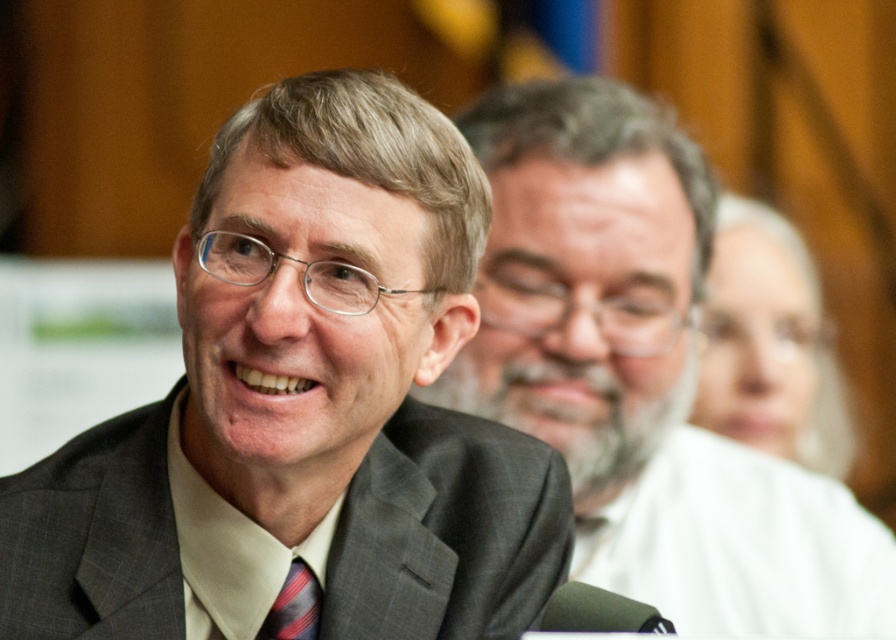
Is gray suit at center smaller than striped fabric tie at center?

Incorrect, gray suit at center is not smaller in size than striped fabric tie at center.

Who is more forward, (632, 472) or (278, 595)?

Point (278, 595)

I want to click on gray suit at center, so click(642, 372).

Is matte gray suit at center behind dark gray textured suit at center?

No, matte gray suit at center is in front of dark gray textured suit at center.

Looking at this image, which is more to the right, matte gray suit at center or dark gray textured suit at center?

Positioned to the right is matte gray suit at center.

Between point (368, 515) and point (527, 506), which one is positioned in front?

Positioned in front is point (368, 515).

What are the coordinates of `matte gray suit at center` in the screenshot? It's located at (303, 406).

Is point (358, 76) positioned behind point (304, 612)?

No.

Is matte gray suit at center further to camera compared to striped fabric tie at center?

No, it is in front of striped fabric tie at center.

Between point (457, 228) and point (289, 598), which one is positioned behind?

Point (289, 598)

This screenshot has height=640, width=896. In order to click on matte gray suit at center in this screenshot , I will do `click(303, 406)`.